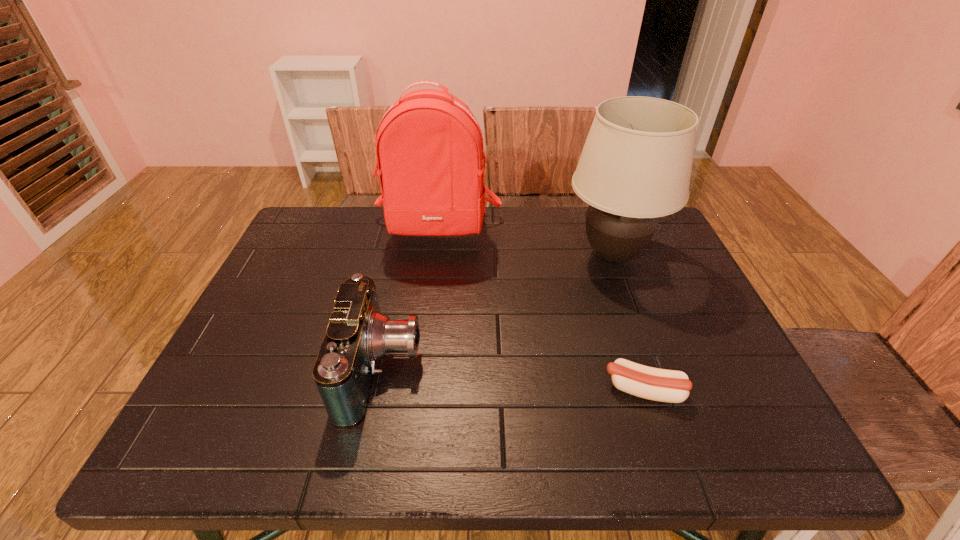
What are the coordinates of `backpack` in the screenshot? It's located at (430, 156).

This screenshot has height=540, width=960. Find the location of `lampshade`. lampshade is located at coordinates (635, 166).

Locate an element on the screen. camcorder is located at coordinates (358, 335).

The height and width of the screenshot is (540, 960). Identify the location of sausage. (663, 385).

Find the location of a particular element. Image resolution: width=960 pixels, height=540 pixels. free spot located on the main compartment of the backpack is located at coordinates (432, 276).

Locate an element on the screen. vacant region located 0.400m on the left of the lampshade is located at coordinates (422, 255).

The image size is (960, 540). In order to click on vacant space situated 0.190m on the front-facing side of the camcorder in this screenshot , I will do `click(509, 370)`.

Locate an element on the screen. free space located on the back of the shortest object is located at coordinates (616, 306).

Find the location of a particular element. This screenshot has height=540, width=960. backpack that is at the far edge is located at coordinates (430, 156).

I want to click on lampshade located at the far edge, so click(x=635, y=166).